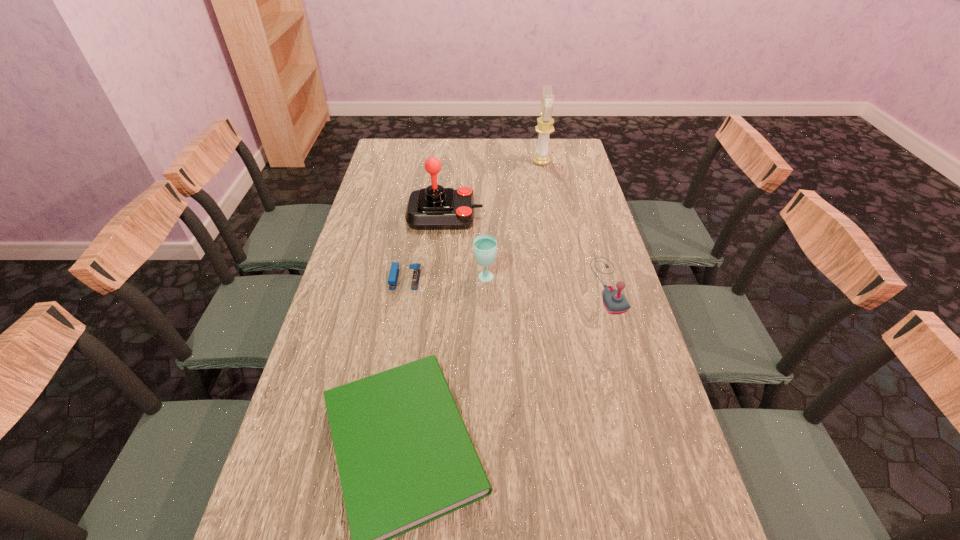
The height and width of the screenshot is (540, 960). Find the location of `free space located on the front-facing side of the award`. free space located on the front-facing side of the award is located at coordinates (445, 162).

What are the coordinates of `blank space located on the base of the farther joystick` in the screenshot? It's located at [530, 215].

This screenshot has height=540, width=960. Find the location of `vacant space located on the right of the glass`. vacant space located on the right of the glass is located at coordinates (589, 278).

Identify the location of vacant space located on the back of the right joystick. The height and width of the screenshot is (540, 960). (593, 233).

Find the location of a particular element. vacant space located 0.370m on the front of the fifth tallest object is located at coordinates (384, 401).

Locate an element on the screen. The image size is (960, 540). object that is at the far edge is located at coordinates (545, 123).

Locate an element on the screen. object positioned at the left edge is located at coordinates (394, 270).

At what (x,y) coordinates should I click in order to perform the action: click on award that is at the right edge. Please return your answer as a coordinate pair (x, y). Looking at the image, I should click on (545, 123).

The width and height of the screenshot is (960, 540). What are the coordinates of `joystick that is at the right edge` in the screenshot? It's located at click(x=614, y=301).

This screenshot has width=960, height=540. Find the location of `object present at the far right corner`. object present at the far right corner is located at coordinates (545, 123).